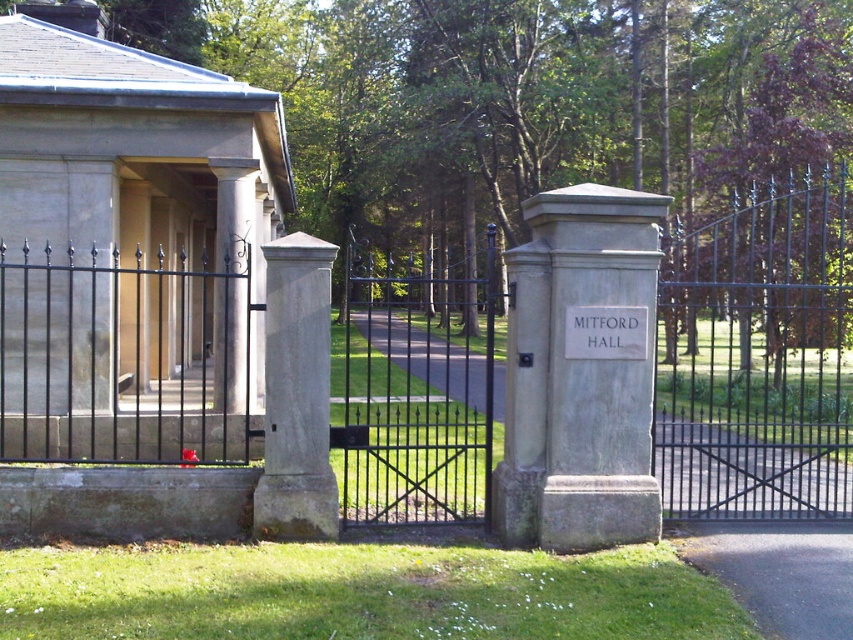
Is point (338, 376) closer to camera compared to point (183, 326)?

No, (338, 376) is further to viewer.

Does black metal fence at center have a greater width compared to black wrought iron gate at left?

Yes, black metal fence at center is wider than black wrought iron gate at left.

Which is in front, point (828, 248) or point (202, 294)?

Point (828, 248) is in front.

Identify the location of black metal fence at center. Image resolution: width=853 pixels, height=640 pixels. (758, 355).

Based on the photo, who is shorter, black metal fence at center or black wrought iron gate at center?

black wrought iron gate at center

Based on the photo, who is more forward, (398, 308) or (358, 300)?

Point (358, 300) is in front.

Which is behind, point (724, 320) or point (364, 468)?

Point (724, 320)

Find the location of a particular element. The height and width of the screenshot is (640, 853). black metal fence at center is located at coordinates (758, 355).

Is black wrought iron gate at left to the left of gray stone sign at center from the viewer's perspective?

Correct, you'll find black wrought iron gate at left to the left of gray stone sign at center.

Between point (32, 300) and point (599, 332), which one is positioned behind?

Positioned behind is point (32, 300).

Locate an element on the screen. Image resolution: width=853 pixels, height=640 pixels. black wrought iron gate at left is located at coordinates (123, 358).

This screenshot has width=853, height=640. Identify the location of black wrought iron gate at left. (123, 358).